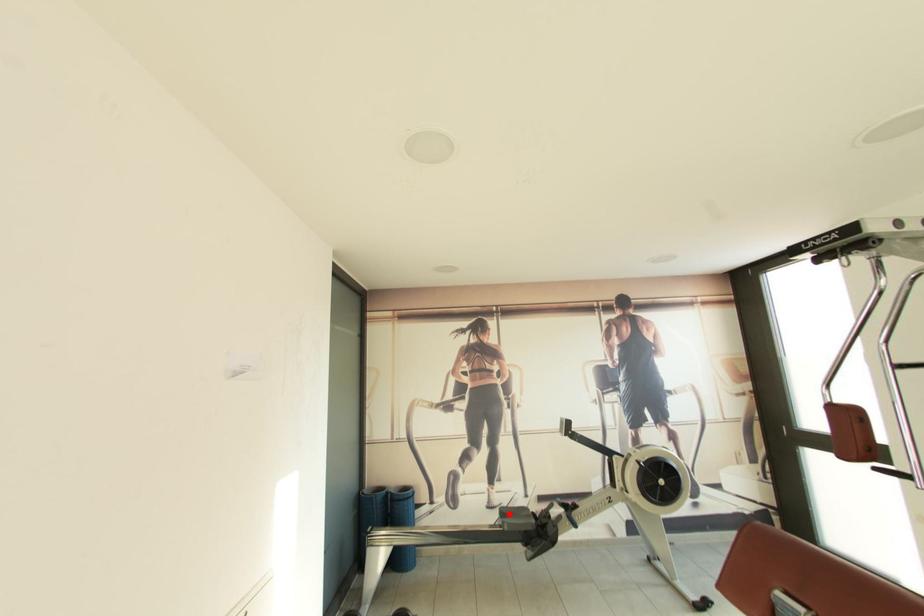
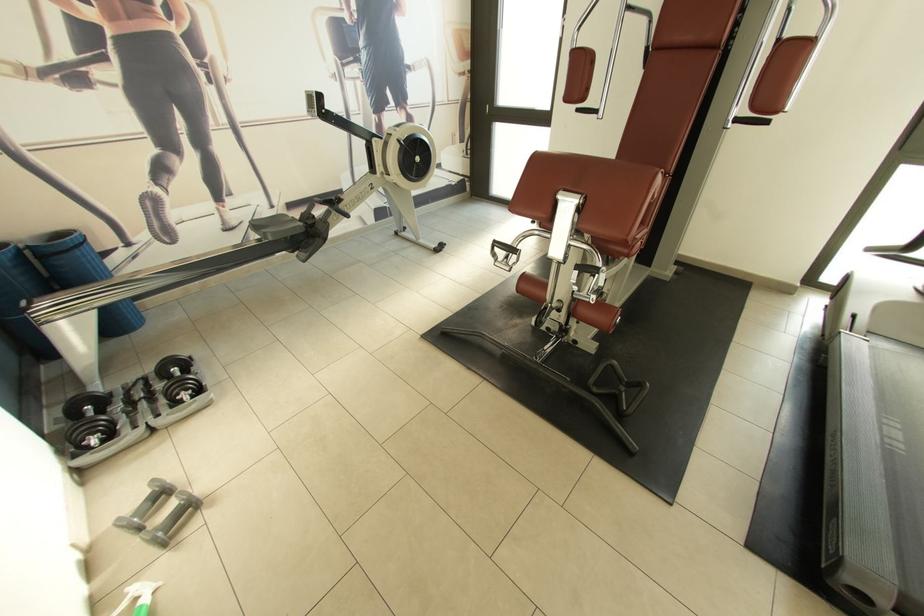
The point at the highlighted location is marked in the first image. Where is the corresponding point in the second image?

(262, 227)